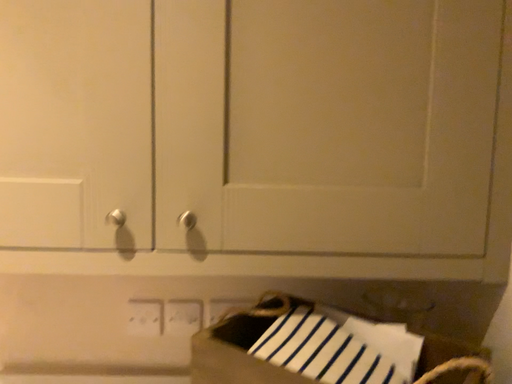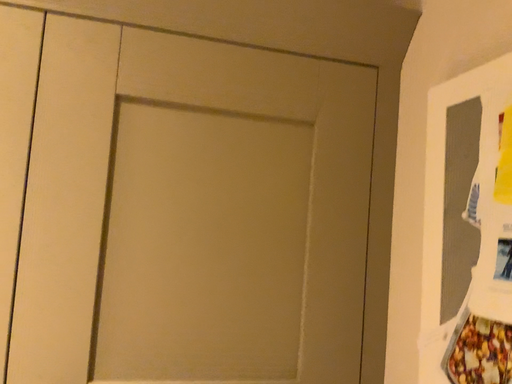
Question: How did the camera likely rotate when shooting the video?

Choices:
 (A) rotated downward
 (B) rotated upward

Answer: (B)